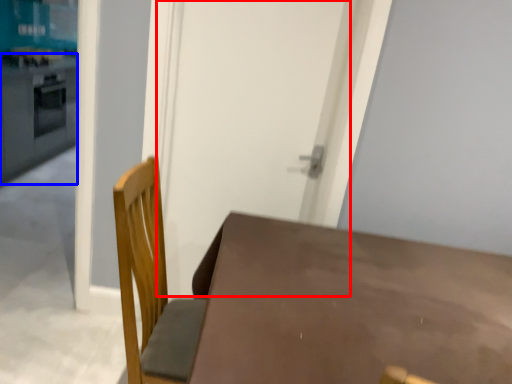
Question: Which object is closer to the camera taking this photo, screen door (highlighted by a red box) or counter top (highlighted by a blue box)?

Choices:
 (A) screen door
 (B) counter top

Answer: (A)